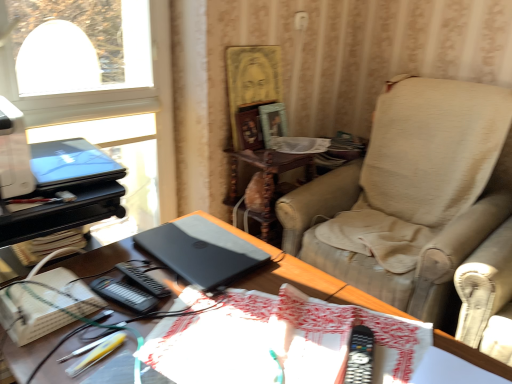
Image resolution: width=512 pixels, height=384 pixels. Identify the location of free space above wooden side table at center (from a real-world perspective). (262, 147).